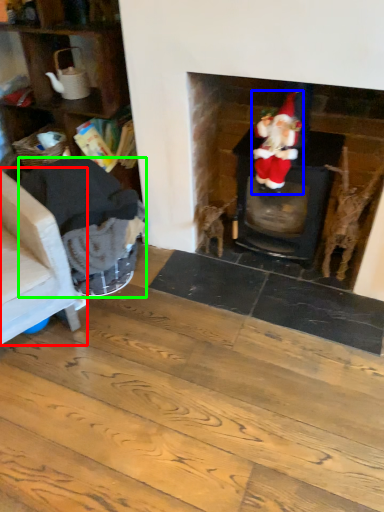
Question: Which is farther away from armchair (highlighted by a red box)? person (highlighted by a blue box) or armchair (highlighted by a green box)?

Choices:
 (A) person
 (B) armchair

Answer: (A)